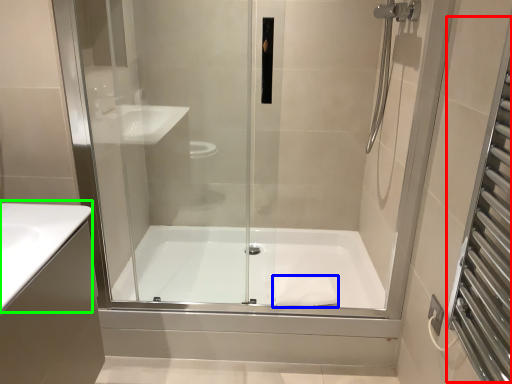
Question: Based on their relative distances, which object is nearer to screen door (highlighted by a red box)? Choose from material (highlighted by a blue box) and counter top (highlighted by a green box).

Choices:
 (A) material
 (B) counter top

Answer: (A)